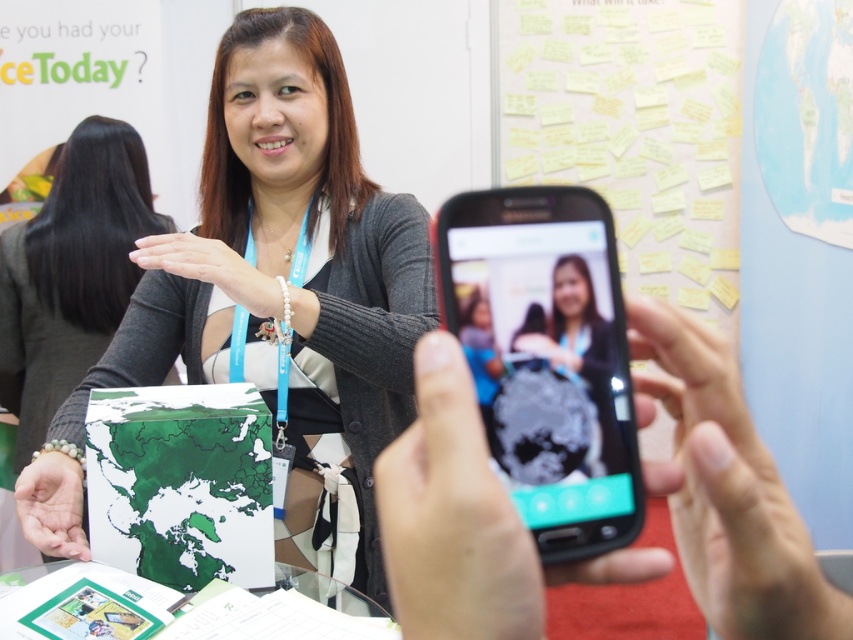
In the scene shown: You are trying to decide whether to place the black matte phone at center into a small pocket in your jacket. The pocket can only fit items smaller than the pearl bracelet at center. Based on the scene, can the phone fit?

The black matte phone at center is smaller than the pearl bracelet at center, so it should fit in the pocket designed for items smaller than the bracelet.

Based on the photo, you are holding a smartphone with the camera open. You want to take a photo of the woman at the booth. The phone has a focus point at point (474, 481). If the recommended focus distance for clear photos is 12 inches, is the current focus distance sufficient?

The focus point at point (474, 481) is 11.27 inches away from the camera. Since this is less than the recommended 12 inches, the current focus distance may be too close for a clear photo.

Where is the smooth skin hand at center located in the image?

The smooth skin hand at center is located at point coordinates of approximately 0.767 on the x axis and 0.856 on the y axis.